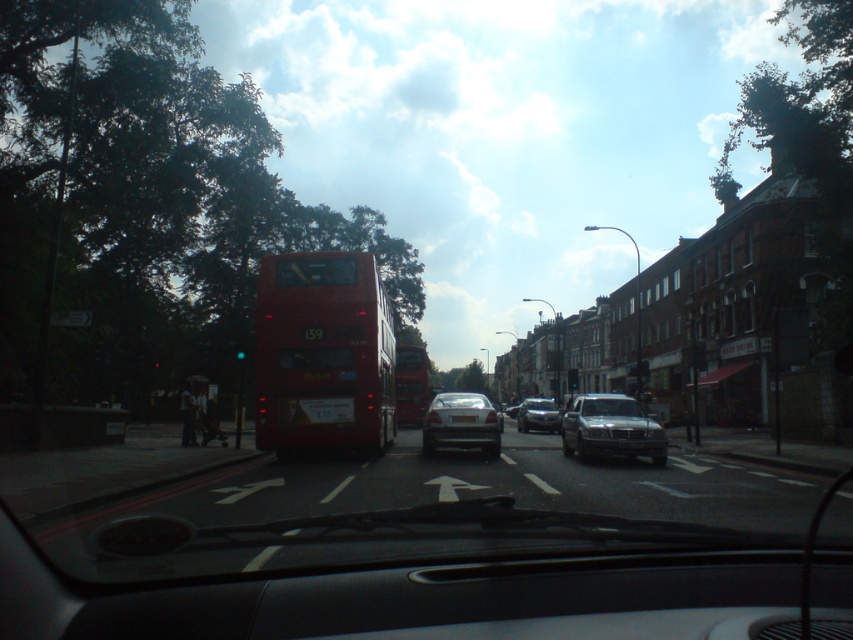
You are driving a car and see the red matte bus at center and the black plastic license plate at center in your view. Which object is closer to you?

The red matte bus at center is closer to you because the black plastic license plate at center is behind it.

You are driving a car and need to make a left turn onto a side street. There is a red matte bus at center in your path. Based on its position, can you safely make the turn without obstructing the bus?

The red matte bus at center is located at coordinates point (410, 385), so you can safely make the turn as long as there is enough space between your car and the bus to maneuver without blocking its path.